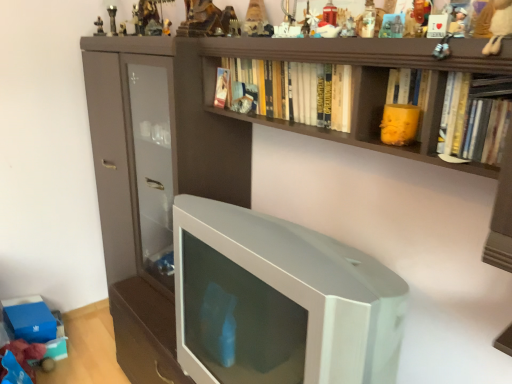
Question: Can you confirm if metallic silver figurine at upper center, the eighth toy when ordered from left to right, is smaller than white plush toy at upper right, which is the 13th toy in back-to-front order?

Choices:
 (A) no
 (B) yes

Answer: (B)

Question: Considering the relative sizes of metallic silver figurine at upper center, the 6th toy when ordered from front to back, and white plush toy at upper right, which is the 13th toy in back-to-front order, in the image provided, is metallic silver figurine at upper center, the 6th toy when ordered from front to back, shorter than white plush toy at upper right, which is the 13th toy in back-to-front order,?

Choices:
 (A) yes
 (B) no

Answer: (A)

Question: Does metallic silver figurine at upper center, the eighth toy when ordered from left to right, appear on the left side of white plush toy at upper right, which is the 13th toy from left to right?

Choices:
 (A) no
 (B) yes

Answer: (B)

Question: Is metallic silver figurine at upper center, which is the 6th toy from right to left, looking in the opposite direction of white plush toy at upper right, which is the 13th toy from left to right?

Choices:
 (A) no
 (B) yes

Answer: (A)

Question: From a real-world perspective, is metallic silver figurine at upper center, which is the 6th toy from right to left, positioned under white plush toy at upper right, the 1th toy in the front-to-back sequence, based on gravity?

Choices:
 (A) no
 (B) yes

Answer: (B)

Question: From their relative heights in the image, would you say wooden heart at upper center, acting as the second toy starting from the right, is taller or shorter than yellow matte cup at upper center, which is the third toy from right to left?

Choices:
 (A) tall
 (B) short

Answer: (B)

Question: Based on their positions, is wooden heart at upper center, the 10th toy when ordered from back to front, located to the left or right of yellow matte cup at upper center, acting as the 11th toy starting from the back?

Choices:
 (A) right
 (B) left

Answer: (A)

Question: From a real-world perspective, is wooden heart at upper center, positioned as the twelfth toy in left-to-right order, positioned above or below yellow matte cup at upper center, the eleventh toy positioned from the left?

Choices:
 (A) above
 (B) below

Answer: (A)

Question: Looking at their shapes, would you say wooden heart at upper center, the 10th toy when ordered from back to front, is wider or thinner than yellow matte cup at upper center, which is the third toy from right to left?

Choices:
 (A) wide
 (B) thin

Answer: (B)

Question: Considering the positions of metallic figurine at upper center, the second toy in the back-to-front sequence, and white matte plush toy at upper center, the 7th toy from the right, in the image, is metallic figurine at upper center, the second toy in the back-to-front sequence, wider or thinner than white matte plush toy at upper center, the 7th toy from the right,?

Choices:
 (A) thin
 (B) wide

Answer: (B)

Question: Is metallic figurine at upper center, which is the twelfth toy in front-to-back order, spatially inside white matte plush toy at upper center, the 7th toy from the right, or outside of it?

Choices:
 (A) outside
 (B) inside

Answer: (A)

Question: Is point (117, 33) closer or farther from the camera than point (330, 28)?

Choices:
 (A) closer
 (B) farther

Answer: (B)

Question: Is metallic figurine at upper center, arranged as the twelfth toy when viewed from the right, in front of or behind white matte plush toy at upper center, positioned as the 7th toy in back-to-front order, in the image?

Choices:
 (A) behind
 (B) front

Answer: (A)

Question: Is matte paper book at upper center, which is counted as the 1th book, starting from the back, inside or outside of hardcover book at upper right, the first book in the right-to-left sequence?

Choices:
 (A) outside
 (B) inside

Answer: (A)

Question: Is point (219, 104) closer or farther from the camera than point (497, 125)?

Choices:
 (A) closer
 (B) farther

Answer: (B)